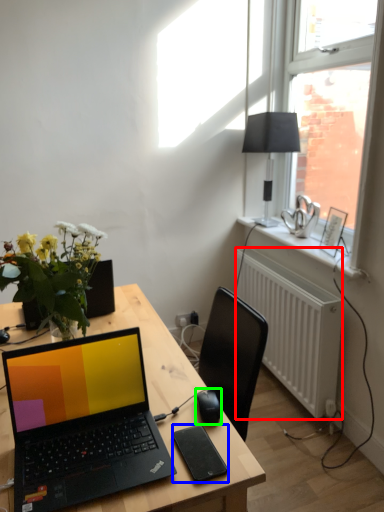
Question: Estimate the real-world distances between objects in this image. Which object is closer to radiator (highlighted by a red box), tablet computer (highlighted by a blue box) or computer mouse (highlighted by a green box)?

Choices:
 (A) tablet computer
 (B) computer mouse

Answer: (B)